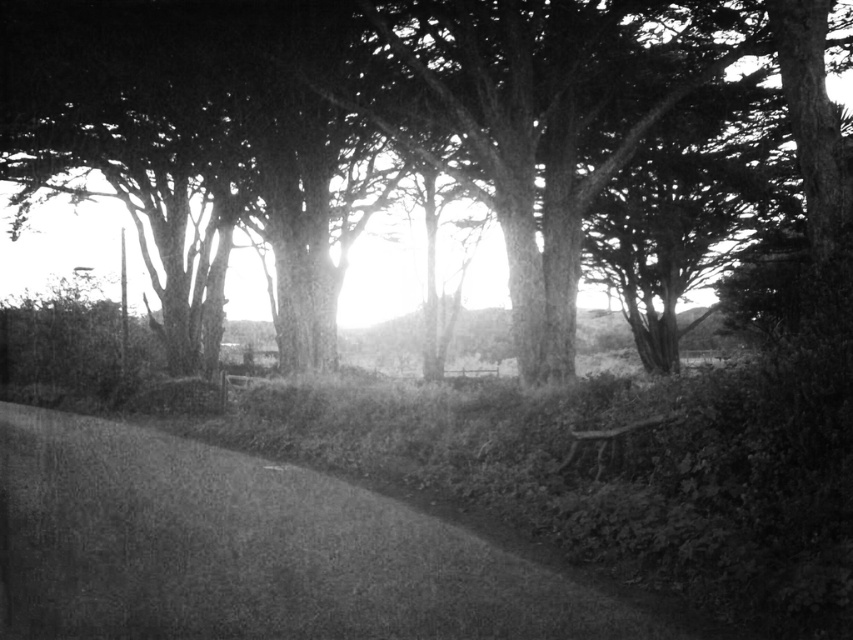
Is gravelly path at center thinner than smooth bark tree at center?

Yes, gravelly path at center is thinner than smooth bark tree at center.

Can you confirm if gravelly path at center is positioned to the right of smooth bark tree at center?

Indeed, gravelly path at center is positioned on the right side of smooth bark tree at center.

Locate an element on the screen. This screenshot has height=640, width=853. gravelly path at center is located at coordinates (250, 550).

I want to click on gravelly path at center, so click(250, 550).

Measure the distance between point (412,285) and camera.

Point (412,285) and camera are 55.87 meters apart.

Who is more distant from viewer, (154, 45) or (608, 461)?

Positioned behind is point (154, 45).

Find the location of a particular element. This screenshot has width=853, height=640. smooth bark tree at center is located at coordinates (148, 33).

Which of these two, gravelly path at center or wooden park bench at lower right, stands shorter?

With less height is gravelly path at center.

Locate an element on the screen. gravelly path at center is located at coordinates (250, 550).

Who is more distant from viewer, [326,490] or [566,461]?

The point [326,490] is behind.

Locate an element on the screen. gravelly path at center is located at coordinates [250, 550].